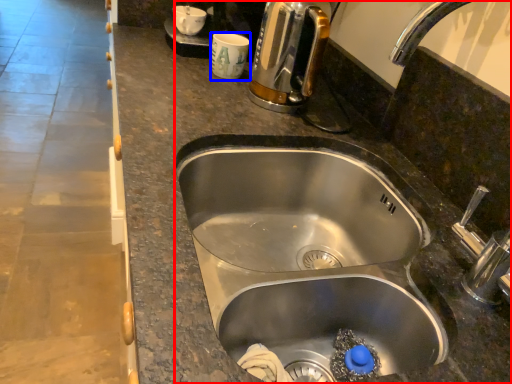
Question: Which object is closer to the camera taking this photo, sink (highlighted by a red box) or coffee cup (highlighted by a blue box)?

Choices:
 (A) sink
 (B) coffee cup

Answer: (A)